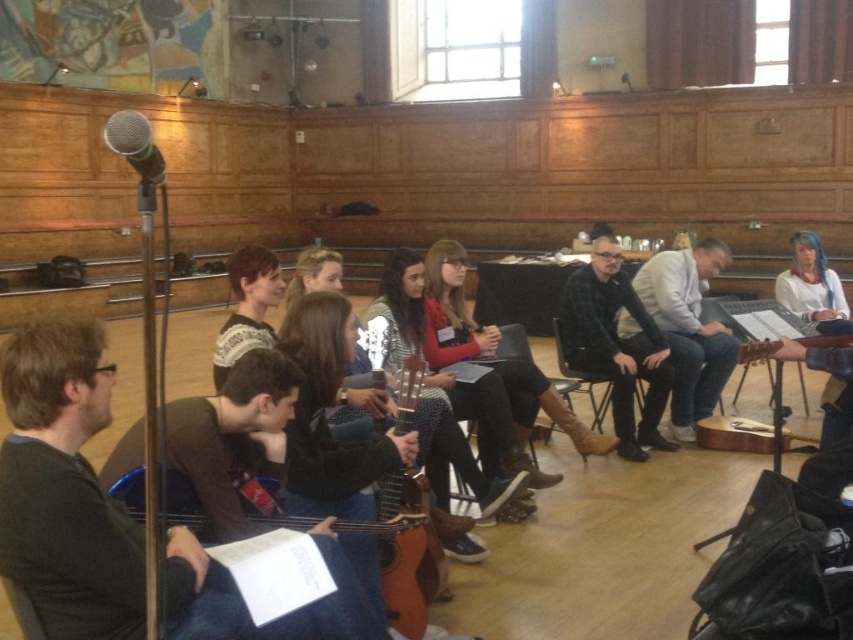
Is white fabric shirt at upper right smaller than silver metallic microphone at upper left?

Actually, white fabric shirt at upper right might be larger than silver metallic microphone at upper left.

Is white fabric shirt at upper right taller than silver metallic microphone at upper left?

Yes, white fabric shirt at upper right is taller than silver metallic microphone at upper left.

Who is more forward, (825, 428) or (115, 120)?

Point (115, 120)

Locate an element on the screen. white fabric shirt at upper right is located at coordinates click(813, 288).

Is the position of acoustic wood guitar at lower left less distant than that of silver metallic microphone at upper left?

No.

Find the location of a particular element. The image size is (853, 640). acoustic wood guitar at lower left is located at coordinates (399, 564).

Is plaid fabric shirt at center to the left of white fabric shirt at upper right from the viewer's perspective?

Correct, you'll find plaid fabric shirt at center to the left of white fabric shirt at upper right.

Does point (584, 266) come farther from viewer compared to point (819, 332)?

Yes, it is.

Describe the element at coordinates (614, 346) in the screenshot. I see `plaid fabric shirt at center` at that location.

The height and width of the screenshot is (640, 853). In order to click on plaid fabric shirt at center in this screenshot , I will do `click(614, 346)`.